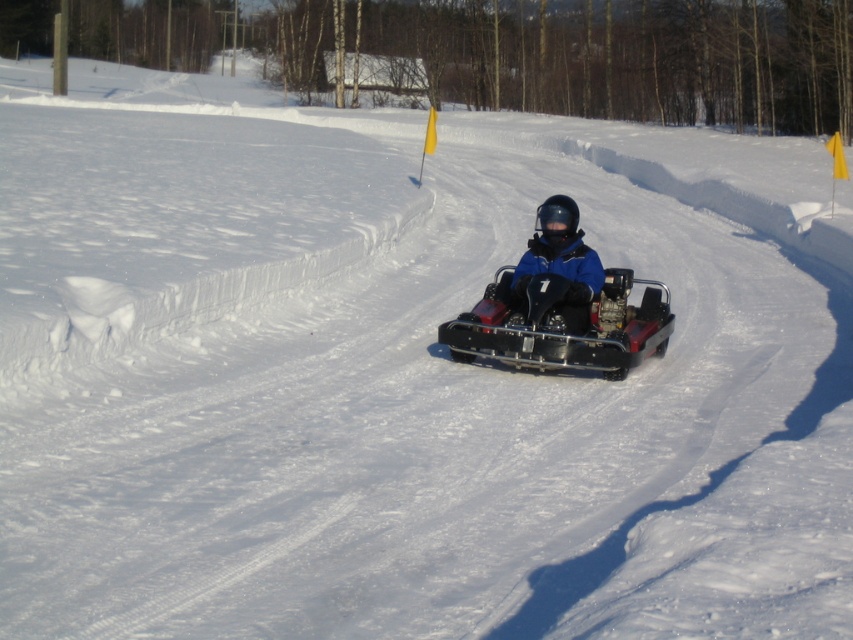
Between point (624, 362) and point (575, 234), which one is positioned behind?

Positioned behind is point (575, 234).

Can you confirm if black plastic go-kart at center is positioned above blue matte jacket at center?

Incorrect, black plastic go-kart at center is not positioned above blue matte jacket at center.

Locate an element on the screen. Image resolution: width=853 pixels, height=640 pixels. black plastic go-kart at center is located at coordinates (564, 324).